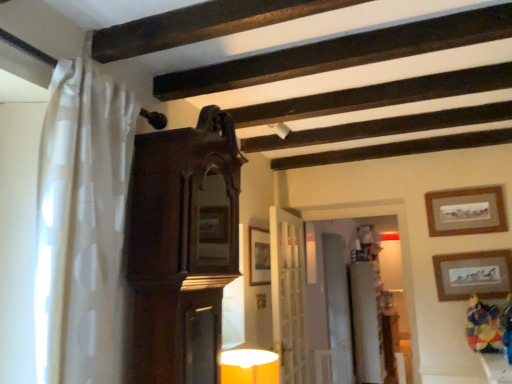
Question: Does white wooden door at center have a greater height compared to matte yellow glass table lamp at lower center?

Choices:
 (A) no
 (B) yes

Answer: (B)

Question: Considering the relative sizes of white wooden door at center and matte yellow glass table lamp at lower center in the image provided, is white wooden door at center shorter than matte yellow glass table lamp at lower center?

Choices:
 (A) yes
 (B) no

Answer: (B)

Question: Does white wooden door at center have a lesser width compared to matte yellow glass table lamp at lower center?

Choices:
 (A) yes
 (B) no

Answer: (A)

Question: Is white wooden door at center oriented away from matte yellow glass table lamp at lower center?

Choices:
 (A) no
 (B) yes

Answer: (A)

Question: Is white wooden door at center positioned beyond the bounds of matte yellow glass table lamp at lower center?

Choices:
 (A) no
 (B) yes

Answer: (B)

Question: Is white wooden door at center behind matte yellow glass table lamp at lower center?

Choices:
 (A) no
 (B) yes

Answer: (B)

Question: Would you consider matte gold picture frame at upper right, the 1th picture frame positioned from the right, to be distant from dark wood cabinet at center?

Choices:
 (A) yes
 (B) no

Answer: (A)

Question: Can you confirm if matte gold picture frame at upper right, the 1th picture frame positioned from the right, is positioned to the right of dark wood cabinet at center?

Choices:
 (A) no
 (B) yes

Answer: (B)

Question: From the image's perspective, is matte gold picture frame at upper right, placed as the 3th picture frame when sorted from left to right, under dark wood cabinet at center?

Choices:
 (A) no
 (B) yes

Answer: (B)

Question: Can you confirm if matte gold picture frame at upper right, the 1th picture frame positioned from the right, is taller than dark wood cabinet at center?

Choices:
 (A) yes
 (B) no

Answer: (B)

Question: Is matte gold picture frame at upper right, placed as the 3th picture frame when sorted from left to right, positioned with its back to dark wood cabinet at center?

Choices:
 (A) no
 (B) yes

Answer: (A)

Question: Does matte gold picture frame at upper right, placed as the 3th picture frame when sorted from left to right, have a smaller size compared to dark wood cabinet at center?

Choices:
 (A) no
 (B) yes

Answer: (B)

Question: Is white glossy dresser at center not within wooden picture frame at center, which ranks as the 1th picture frame in left-to-right order?

Choices:
 (A) yes
 (B) no

Answer: (A)